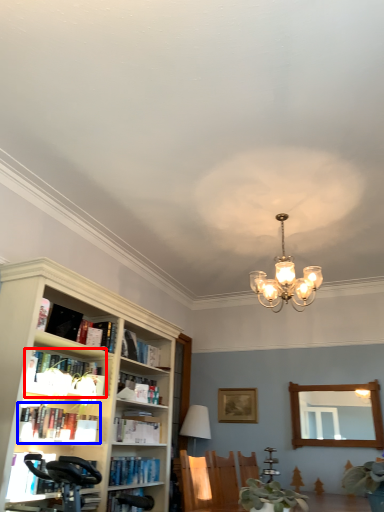
Question: Which object is further to the camera taking this photo, book (highlighted by a red box) or book (highlighted by a blue box)?

Choices:
 (A) book
 (B) book

Answer: (A)